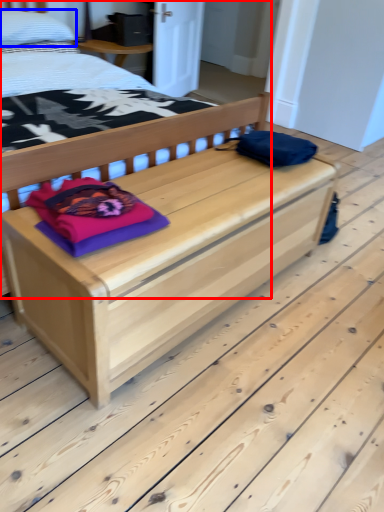
Question: Which object is further to the camera taking this photo, bed (highlighted by a red box) or pillow (highlighted by a blue box)?

Choices:
 (A) bed
 (B) pillow

Answer: (B)